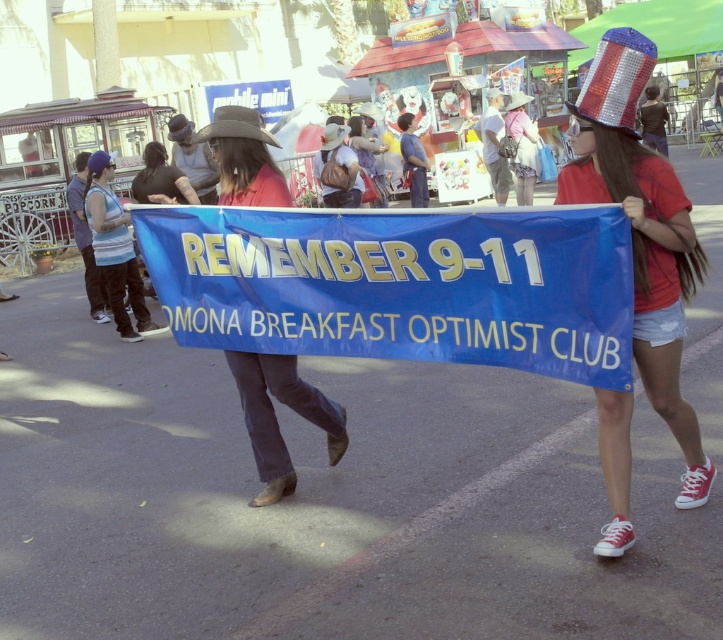
You are a photographer at the event and want to capture a photo where both the shiny sequined hat at upper right and the matte red shirt at center are visible. Considering their sizes, which object should you focus on to ensure both fit in the frame?

Since the shiny sequined hat at upper right is wider than the matte red shirt at center, you should focus on the shiny sequined hat at upper right to ensure both fit in the frame as it takes up more space.

What are the coordinates of the blue fabric banner at center in the image?

The blue fabric banner at center is located at coordinates point (401, 284).